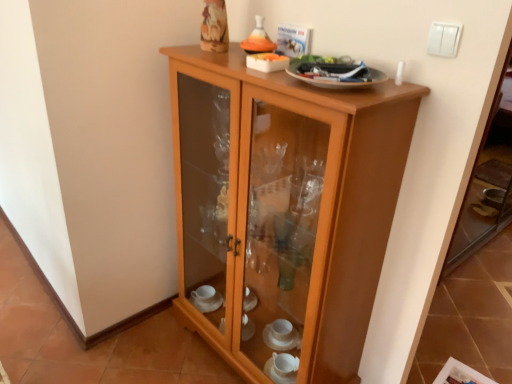
Question: From the image's perspective, is white plastic light switch at upper right positioned above or below light brown wood cupboard at center?

Choices:
 (A) above
 (B) below

Answer: (A)

Question: In terms of size, does white plastic light switch at upper right appear bigger or smaller than light brown wood cupboard at center?

Choices:
 (A) big
 (B) small

Answer: (B)

Question: Is white plastic light switch at upper right wider or thinner than light brown wood cupboard at center?

Choices:
 (A) wide
 (B) thin

Answer: (B)

Question: From the image's perspective, is light brown wood cupboard at center positioned above or below white plastic light switch at upper right?

Choices:
 (A) below
 (B) above

Answer: (A)

Question: In terms of size, does light brown wood cupboard at center appear bigger or smaller than white plastic light switch at upper right?

Choices:
 (A) big
 (B) small

Answer: (A)

Question: In the image, is light brown wood cupboard at center positioned in front of or behind white plastic light switch at upper right?

Choices:
 (A) behind
 (B) front

Answer: (B)

Question: Is light brown wood cupboard at center inside the boundaries of white plastic light switch at upper right, or outside?

Choices:
 (A) outside
 (B) inside

Answer: (A)